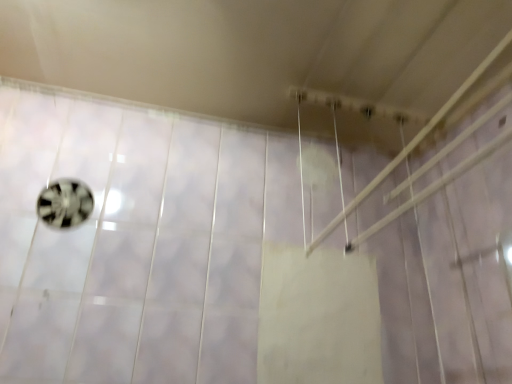
Question: From the image's perspective, relative to metallic silver ball at left, is white plastic shower at upper center above or below?

Choices:
 (A) above
 (B) below

Answer: (A)

Question: Looking at their shapes, would you say white plastic shower at upper center is wider or thinner than metallic silver ball at left?

Choices:
 (A) thin
 (B) wide

Answer: (B)

Question: From a real-world perspective, relative to metallic silver ball at left, is white plastic shower at upper center vertically above or below?

Choices:
 (A) below
 (B) above

Answer: (B)

Question: Looking at their shapes, would you say metallic silver ball at left is wider or thinner than white plastic shower at upper center?

Choices:
 (A) thin
 (B) wide

Answer: (A)

Question: Do you think metallic silver ball at left is within white plastic shower at upper center, or outside of it?

Choices:
 (A) inside
 (B) outside

Answer: (B)

Question: From a real-world perspective, relative to white plastic shower at upper center, is metallic silver ball at left vertically above or below?

Choices:
 (A) above
 (B) below

Answer: (B)

Question: Is metallic silver ball at left taller or shorter than white plastic shower at upper center?

Choices:
 (A) short
 (B) tall

Answer: (A)